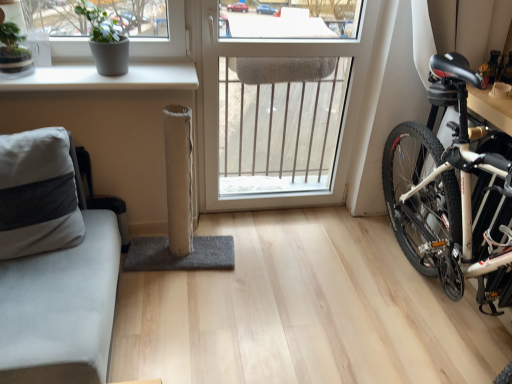
Question: Is gray matte pot at upper left next to gray fabric couch at left?

Choices:
 (A) yes
 (B) no

Answer: (B)

Question: Would you say gray fabric couch at left is part of gray matte pot at upper left's contents?

Choices:
 (A) yes
 (B) no

Answer: (B)

Question: From the image's perspective, is gray matte pot at upper left on top of gray fabric couch at left?

Choices:
 (A) no
 (B) yes

Answer: (B)

Question: Is gray matte pot at upper left aimed at gray fabric couch at left?

Choices:
 (A) yes
 (B) no

Answer: (B)

Question: Is gray matte pot at upper left facing away from gray fabric couch at left?

Choices:
 (A) yes
 (B) no

Answer: (B)

Question: Can you confirm if gray matte pot at upper left is positioned to the right of gray fabric couch at left?

Choices:
 (A) yes
 (B) no

Answer: (A)

Question: Is gray fabric couch at left positioned with its back to white matte window sill at upper left?

Choices:
 (A) no
 (B) yes

Answer: (B)

Question: Considering the relative sizes of gray fabric couch at left and white matte window sill at upper left in the image provided, is gray fabric couch at left thinner than white matte window sill at upper left?

Choices:
 (A) no
 (B) yes

Answer: (A)

Question: Does gray fabric couch at left have a greater height compared to white matte window sill at upper left?

Choices:
 (A) no
 (B) yes

Answer: (B)

Question: Is gray fabric couch at left at the left side of white matte window sill at upper left?

Choices:
 (A) yes
 (B) no

Answer: (A)

Question: Is gray fabric couch at left bigger than white matte window sill at upper left?

Choices:
 (A) no
 (B) yes

Answer: (B)

Question: Is gray fabric couch at left smaller than white matte window sill at upper left?

Choices:
 (A) yes
 (B) no

Answer: (B)

Question: From a real-world perspective, is gray matte pot at upper left physically above white plastic window at center?

Choices:
 (A) yes
 (B) no

Answer: (A)